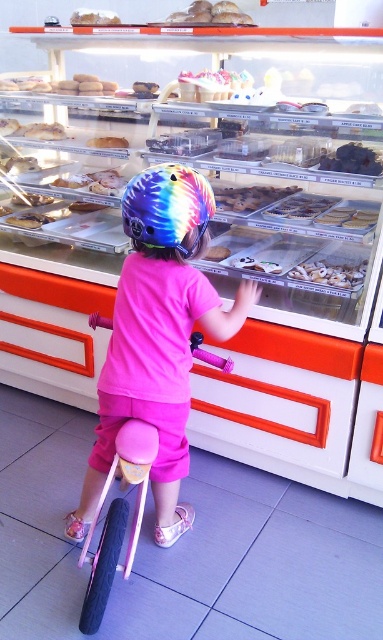
You are a delivery person who needs to fit both the pink matte bicycle at center and the smooth white bread at upper center into a delivery box. The box can only accommodate one large item. Which item should you prioritize placing in the box first?

The pink matte bicycle at center is larger in size than the smooth white bread at upper center, so you should prioritize placing the pink matte bicycle at center first to ensure it fits in the delivery box.